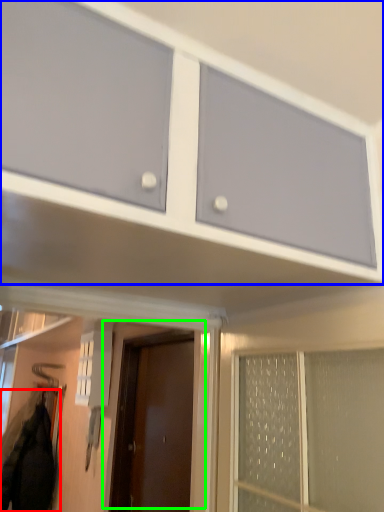
Question: Which is nearer to the jacket (highlighted by a red box)? cabinetry (highlighted by a blue box) or door (highlighted by a green box).

Choices:
 (A) cabinetry
 (B) door

Answer: (B)